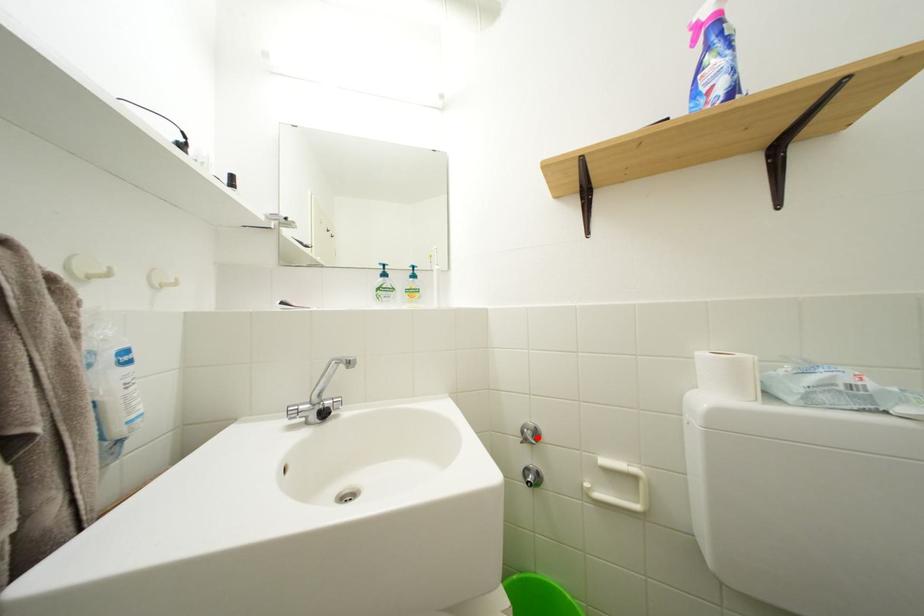
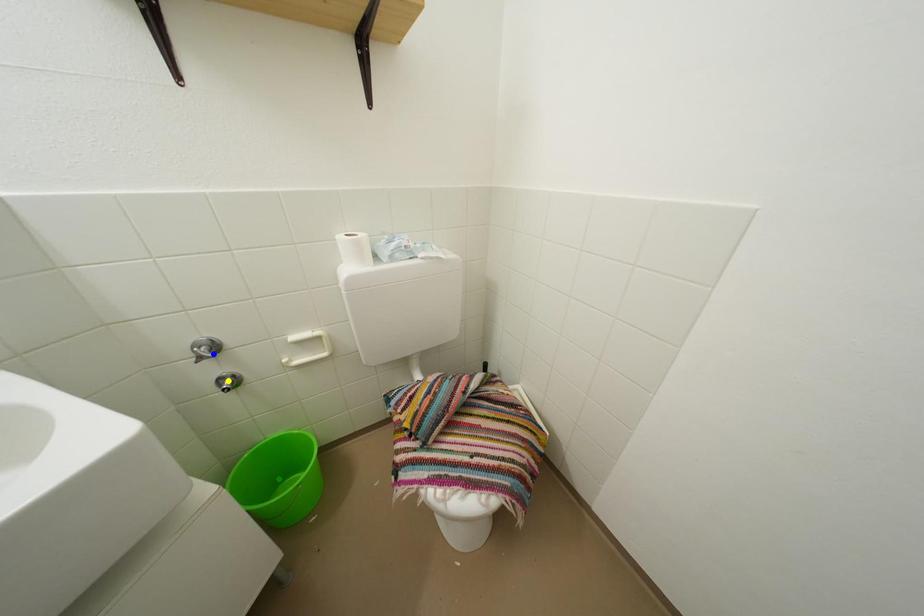
Question: I am providing you with two images of the same scene from different viewpoints. A red point is marked on the first image. You are given multiple points on the second image. Which point in image 2 is actually the same real-world point as the red point in image 1?

Choices:
 (A) blue point
 (B) green point
 (C) yellow point

Answer: (A)